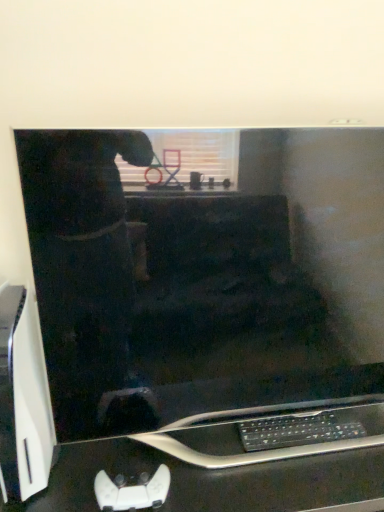
Question: Does point (321, 437) appear closer or farther from the camera than point (200, 496)?

Choices:
 (A) closer
 (B) farther

Answer: (B)

Question: From the image's perspective, is black plastic keyboard at lower center located above or below black glossy computer desk at lower center?

Choices:
 (A) below
 (B) above

Answer: (B)

Question: From their relative heights in the image, would you say black plastic keyboard at lower center is taller or shorter than black glossy computer desk at lower center?

Choices:
 (A) short
 (B) tall

Answer: (A)

Question: From a real-world perspective, relative to black plastic keyboard at lower center, is black glossy computer desk at lower center vertically above or below?

Choices:
 (A) above
 (B) below

Answer: (B)

Question: Considering the positions of black glossy computer desk at lower center and black plastic keyboard at lower center in the image, is black glossy computer desk at lower center wider or thinner than black plastic keyboard at lower center?

Choices:
 (A) thin
 (B) wide

Answer: (B)

Question: Considering the positions of black glossy computer desk at lower center and black plastic keyboard at lower center in the image, is black glossy computer desk at lower center taller or shorter than black plastic keyboard at lower center?

Choices:
 (A) short
 (B) tall

Answer: (B)

Question: Relative to black plastic keyboard at lower center, is black glossy computer desk at lower center in front or behind?

Choices:
 (A) behind
 (B) front

Answer: (B)